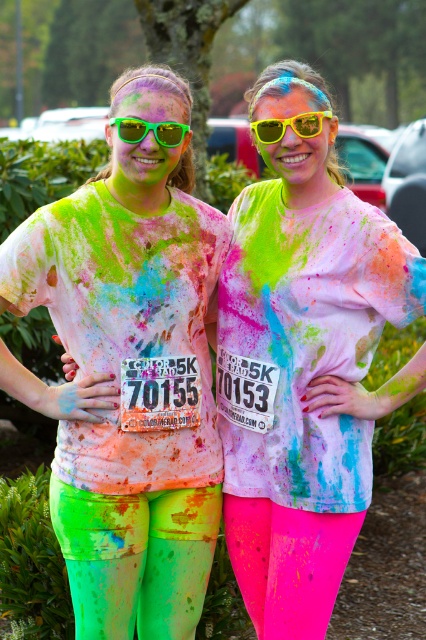
Question: Among these objects, which one is farthest from the camera?

Choices:
 (A) neon green fabric shirt at center
 (B) green reflective sunglasses at center
 (C) yellow matte sunglasses at center
 (D) neon pink leggings at center

Answer: (D)

Question: Is the position of neon pink leggings at center more distant than that of yellow matte sunglasses at center?

Choices:
 (A) yes
 (B) no

Answer: (A)

Question: Among these points, which one is farthest from the camera?

Choices:
 (A) (164, 474)
 (B) (284, 129)
 (C) (324, 589)

Answer: (A)

Question: Is neon green fabric shirt at center behind neon pink leggings at center?

Choices:
 (A) yes
 (B) no

Answer: (B)

Question: Where is neon green fabric shirt at center located in relation to green reflective sunglasses at center in the image?

Choices:
 (A) right
 (B) left

Answer: (B)

Question: Estimate the real-world distances between objects in this image. Which object is closer to the green reflective sunglasses at center?

Choices:
 (A) yellow matte sunglasses at center
 (B) neon pink leggings at center
 (C) neon green fabric shirt at center

Answer: (A)